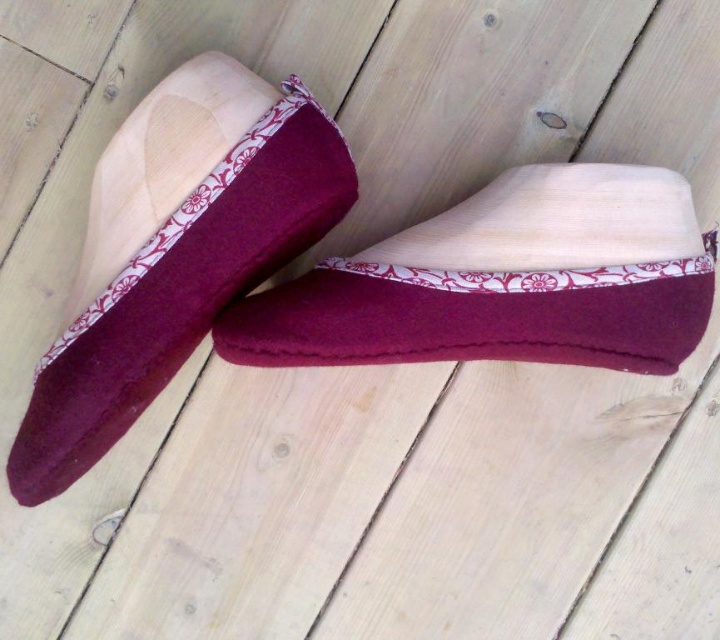
You are a delivery robot tasked with placing a package on the wooden surface. The package must be placed exactly between the burgundy felt slipper at center and the burgundy felt sock at center. What is the minimum distance the robot needs to move the package to ensure it is centered between them?

The burgundy felt slipper at center and burgundy felt sock at center are 10.23 inches apart. To center the package between them, the robot needs to move it 5.115 inches from either object, so the minimum distance required is 5.115 inches.